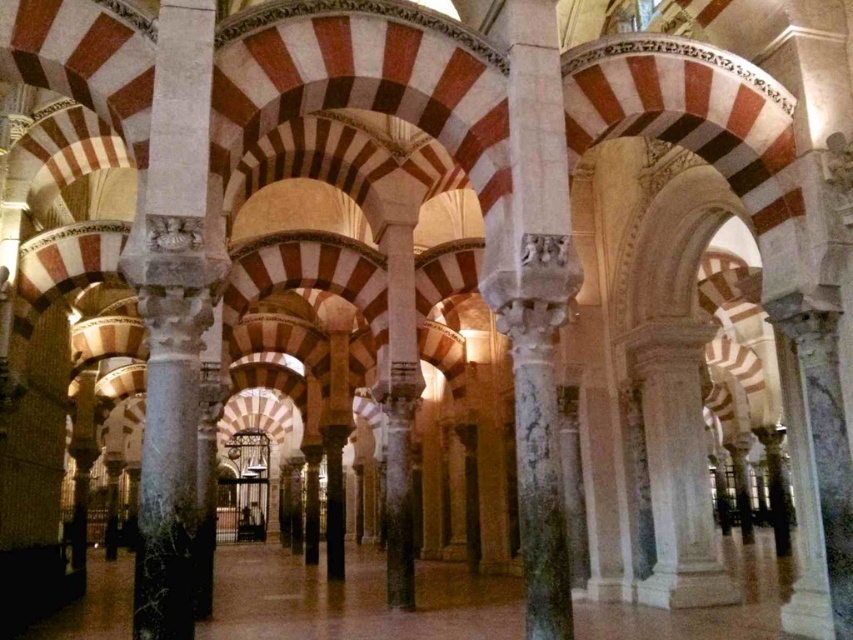
Question: Is marble column at left further to the viewer compared to marble column at center?

Choices:
 (A) no
 (B) yes

Answer: (A)

Question: Is marble column at left above marble column at center?

Choices:
 (A) yes
 (B) no

Answer: (A)

Question: Does marble column at left appear under marble column at center?

Choices:
 (A) no
 (B) yes

Answer: (A)

Question: Which of the following is the closest to the observer?

Choices:
 (A) marble column at center
 (B) marble column at left

Answer: (B)

Question: Which object appears farthest from the camera in this image?

Choices:
 (A) marble column at left
 (B) marble column at center

Answer: (B)